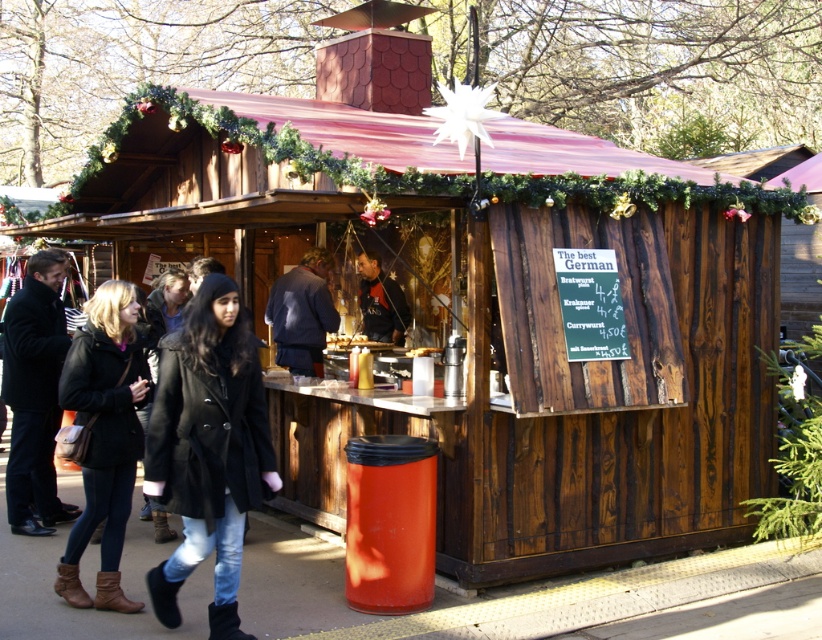
Question: Among these objects, which one is farthest from the camera?

Choices:
 (A) black wool coat at center
 (B) matte black coat at lower left
 (C) dark blue fabric jacket at center
 (D) black wool coat at left

Answer: (C)

Question: Which object is positioned farthest from the dark blue jacket at center?

Choices:
 (A) black wool coat at center
 (B) dark blue fabric jacket at center
 (C) matte black coat at lower left

Answer: (B)

Question: In this image, where is matte black coat at lower left located relative to dark blue jacket at center?

Choices:
 (A) right
 (B) left

Answer: (B)

Question: Does black wool coat at center appear under matte black coat at lower left?

Choices:
 (A) no
 (B) yes

Answer: (B)

Question: Does dark blue jacket at center appear on the left side of dark blue fabric jacket at center?

Choices:
 (A) no
 (B) yes

Answer: (B)

Question: Which object is closer to the camera taking this photo?

Choices:
 (A) black wool coat at left
 (B) matte black coat at lower left

Answer: (B)